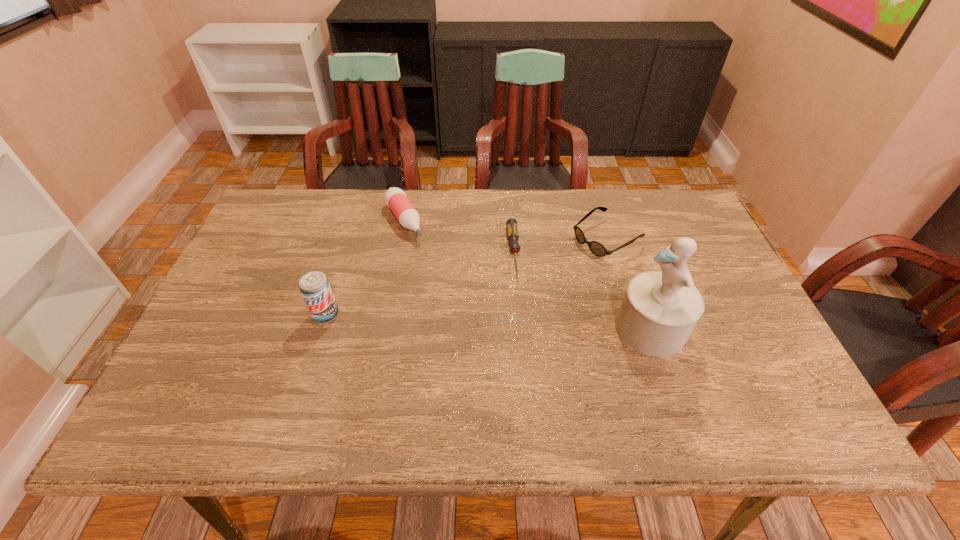
Locate an element on the screen. vacant region located at the beak of the tallest object is located at coordinates (497, 329).

At what (x,y) coordinates should I click in order to perform the action: click on free space located 0.320m at the beak of the tallest object. Please return your answer as a coordinate pair (x, y). Looking at the image, I should click on (485, 329).

This screenshot has height=540, width=960. I want to click on free space located on the lenses of the fourth tallest object, so click(496, 298).

You are a GUI agent. You are given a task and a screenshot of the screen. Output one action in this format:
    pyautogui.click(x=<x>, y=<y>)
    Task: Click on the free space located on the lenses of the fourth tallest object
    Image resolution: width=960 pixels, height=540 pixels.
    Given the screenshot: What is the action you would take?
    pyautogui.click(x=502, y=295)

The width and height of the screenshot is (960, 540). In order to click on vacant space located on the lenses of the fourth tallest object in this screenshot , I will do `click(545, 271)`.

You are a GUI agent. You are given a task and a screenshot of the screen. Output one action in this format:
    pyautogui.click(x=<x>, y=<y>)
    Task: Click on the blank space located 0.100m insert the shortest object into a screw head
    The height and width of the screenshot is (540, 960).
    Given the screenshot: What is the action you would take?
    pyautogui.click(x=520, y=311)

Locate an element on the screen. vacant space located insert the shortest object into a screw head is located at coordinates (525, 358).

What are the coordinates of `free space located insert the shortest object into a screw head` in the screenshot? It's located at (523, 337).

The width and height of the screenshot is (960, 540). What are the coordinates of `blank area located with the cap open on the bottle` in the screenshot? It's located at (425, 261).

Where is `vacant space situated 0.200m with the cap open on the bottle`? The height and width of the screenshot is (540, 960). vacant space situated 0.200m with the cap open on the bottle is located at coordinates (441, 284).